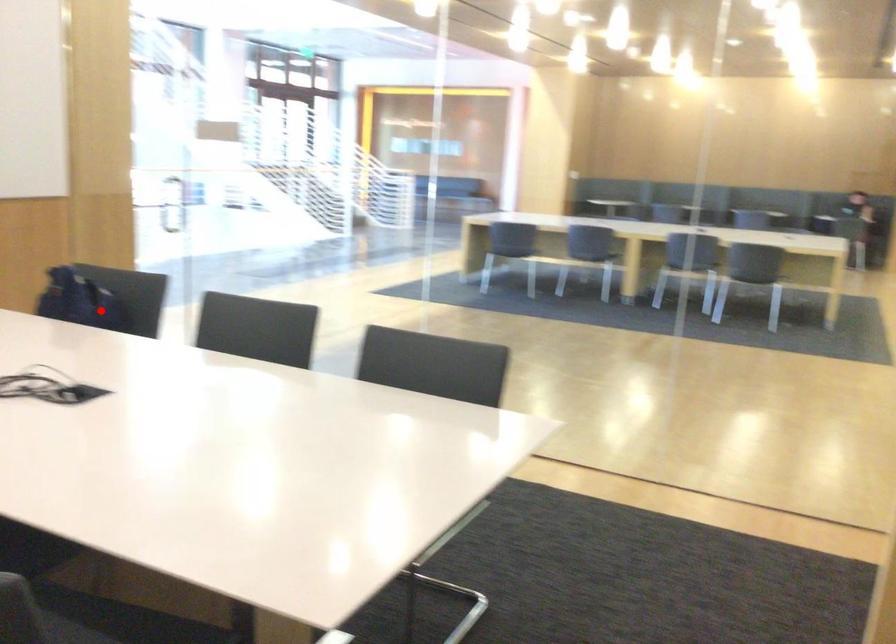
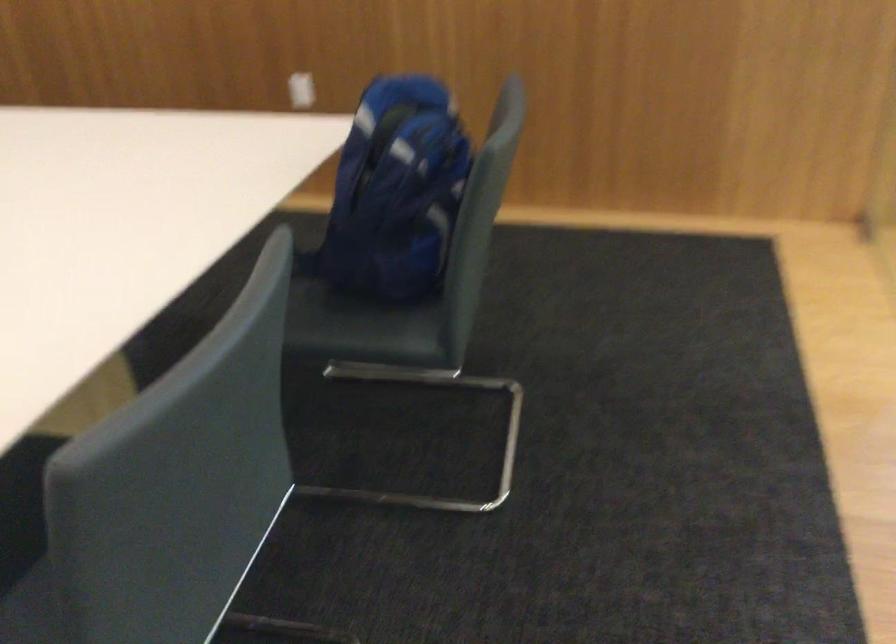
The point at the highlighted location is marked in the first image. Where is the corresponding point in the second image?

(395, 192)